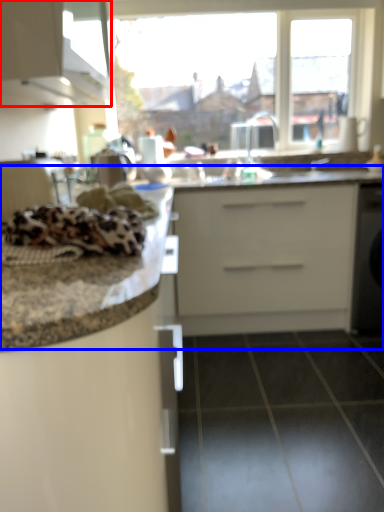
Question: Which object appears closest to the camera in this image, cabinetry (highlighted by a red box) or counter top (highlighted by a blue box)?

Choices:
 (A) cabinetry
 (B) counter top

Answer: (A)